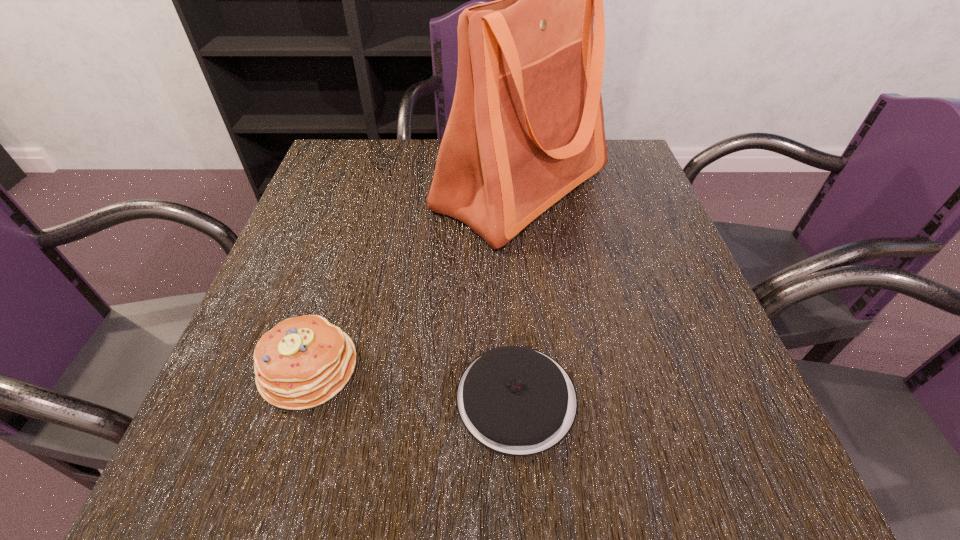
You are a GUI agent. You are given a task and a screenshot of the screen. Output one action in this format:
    pyautogui.click(x=<x>, y=<y>)
    Task: Click on the object identified as the second closest to the second tallest object
    This screenshot has height=540, width=960.
    Given the screenshot: What is the action you would take?
    pyautogui.click(x=526, y=127)

Choose which object is the nearest neighbor to the left pancake. Please provide its 2D coordinates. Your answer should be formatted as a tuple, i.e. [(x, y)], where the tuple contains the x and y coordinates of a point satisfying the conditions above.

[(516, 400)]

The image size is (960, 540). I want to click on vacant space that satisfies the following two spatial constraints: 1. on the front side of the right pancake; 2. on the right side of the second tallest object, so click(300, 398).

The image size is (960, 540). Identify the location of free space that satisfies the following two spatial constraints: 1. on the back side of the right pancake; 2. on the left side of the shopping bag. (503, 189).

I want to click on vacant area in the image that satisfies the following two spatial constraints: 1. on the front side of the taller pancake; 2. on the left side of the shorter pancake, so click(300, 398).